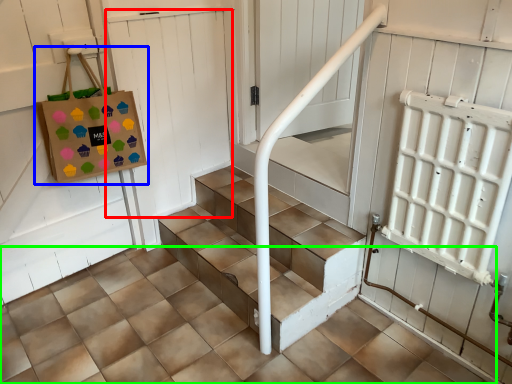
Question: Based on their relative distances, which object is nearer to door (highlighted by a red box)? Choose from bag (highlighted by a blue box) and concrete (highlighted by a green box).

Choices:
 (A) bag
 (B) concrete

Answer: (A)